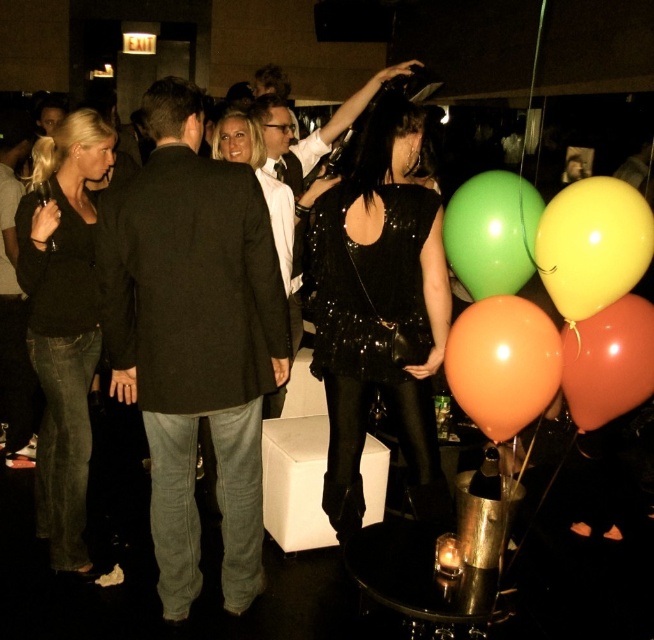
You are a guest at the party and want to take a photo of the yellow matte balloon at upper right and the rubberized orange balloon at lower right. Which balloon should you focus on first if you want to capture both in the same frame without moving the camera?

The yellow matte balloon at upper right is positioned over the rubberized orange balloon at lower right, so you should focus on the yellow matte balloon at upper right first to ensure both are in the frame.

You are planning to take a photo of the black wool suit at center and the orange matte balloon at lower right. Which object should you focus on first if you want to capture both in the same frame without moving the camera?

The black wool suit at center is closer to you than the orange matte balloon at lower right, so you should focus on the black wool suit at center first to ensure both are in focus.